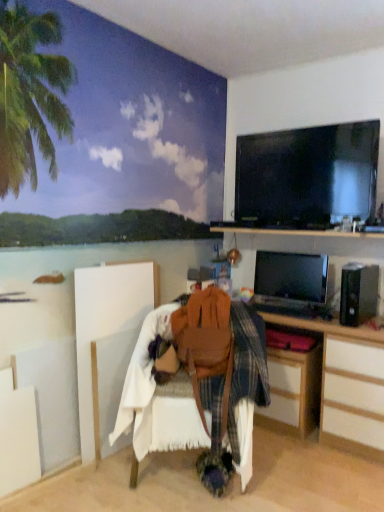
Identify the location of vacant area that lies in front of wooden desk at lower right. (296, 449).